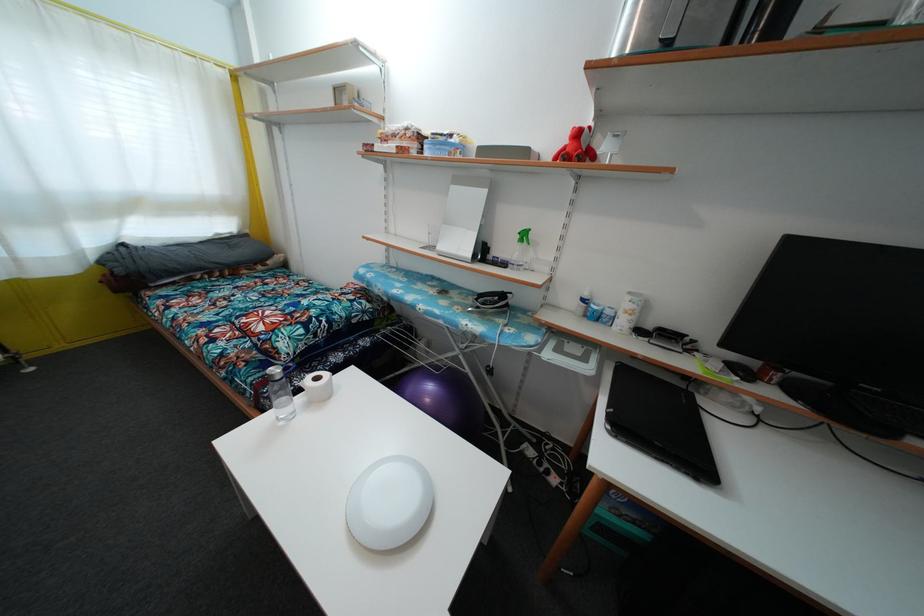
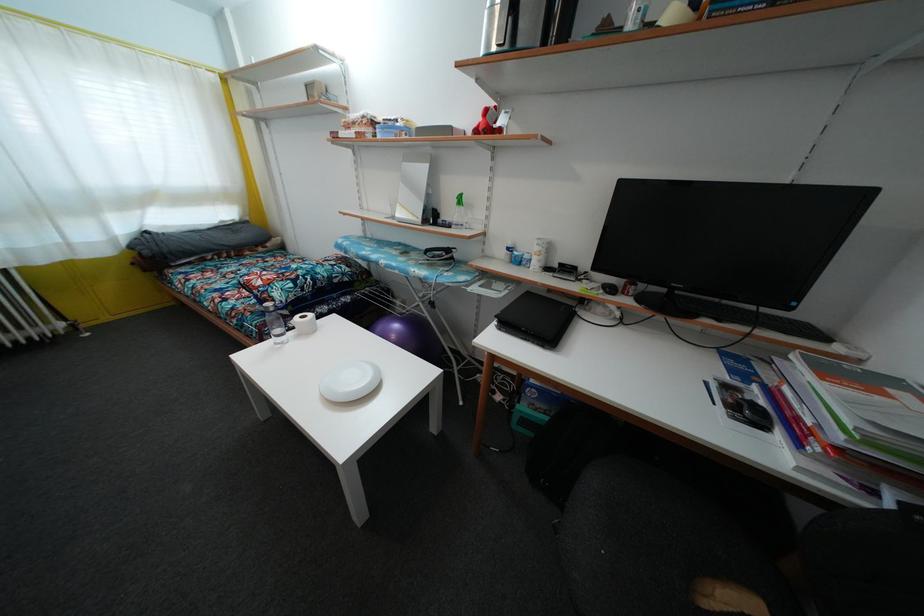
Find the pixel in the second image that matches [581,140] in the first image.

(490, 119)